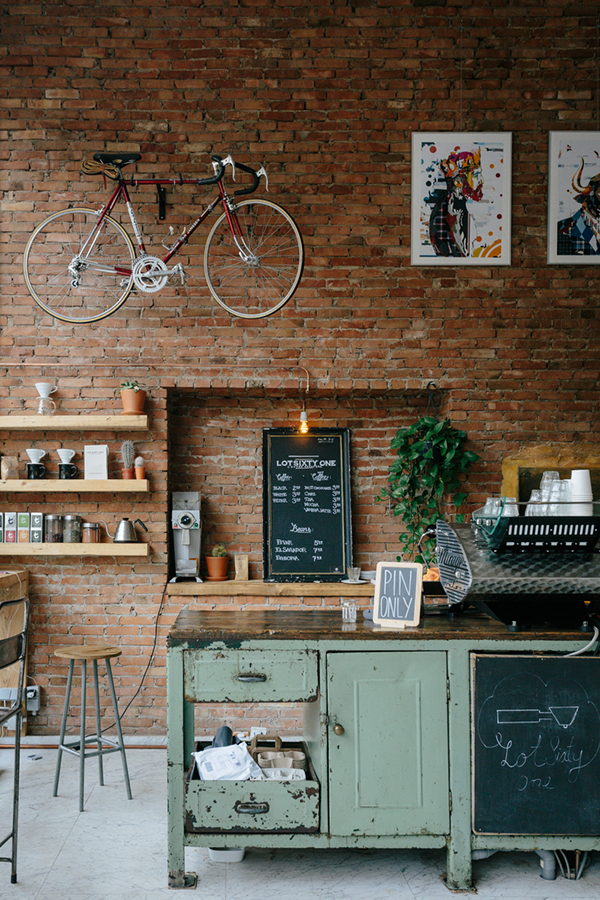
Locate an element on the screen. Image resolution: width=600 pixels, height=900 pixels. shelves is located at coordinates (253, 590), (113, 550), (111, 484), (101, 421).